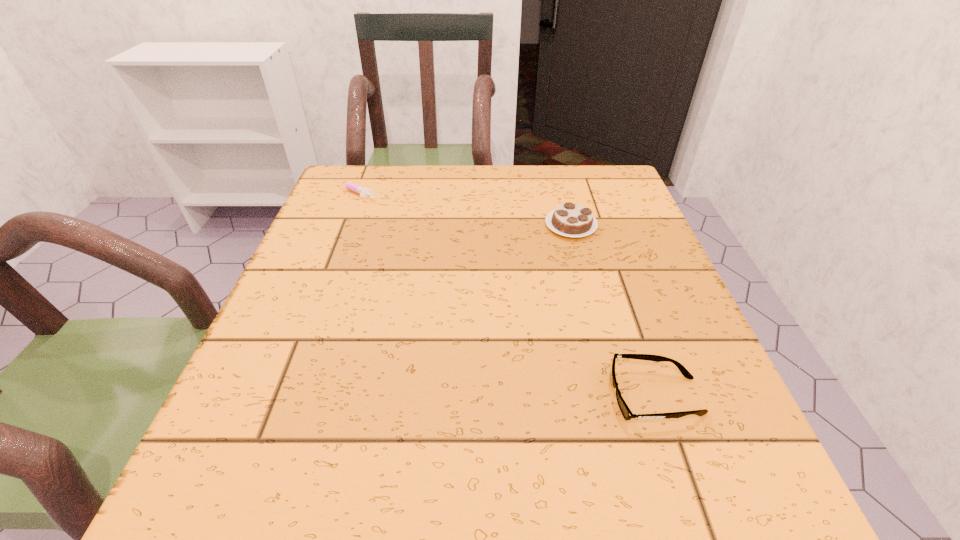
Locate an element on the screen. vacant area between the chocolate cake and the farthest object is located at coordinates (462, 209).

The width and height of the screenshot is (960, 540). In order to click on vacant point located between the second nearest object and the sunglasses in this screenshot , I will do `click(613, 311)`.

Locate an element on the screen. blank region between the sunglasses and the second farthest object is located at coordinates (613, 311).

Image resolution: width=960 pixels, height=540 pixels. What are the coordinates of `vacant area that lies between the farthest object and the second farthest object` in the screenshot? It's located at (462, 209).

Find the location of a particular element. The width and height of the screenshot is (960, 540). object identified as the closest to the leftmost object is located at coordinates 571,220.

You are a GUI agent. You are given a task and a screenshot of the screen. Output one action in this format:
    pyautogui.click(x=<x>, y=<y>)
    Task: Click on the object that ranks as the closest to the chocolate cake
    Image resolution: width=960 pixels, height=540 pixels.
    Given the screenshot: What is the action you would take?
    pyautogui.click(x=626, y=412)

Where is `vacant area in the image that satisfies the following two spatial constraints: 1. on the front side of the chocolate cake; 2. on the right side of the leftmost object`? vacant area in the image that satisfies the following two spatial constraints: 1. on the front side of the chocolate cake; 2. on the right side of the leftmost object is located at coordinates (340, 226).

You are a GUI agent. You are given a task and a screenshot of the screen. Output one action in this format:
    pyautogui.click(x=<x>, y=<y>)
    Task: Click on the free space that satisfies the following two spatial constraints: 1. on the front side of the farthest object; 2. on the left side of the chocolate cake
    
    Given the screenshot: What is the action you would take?
    pyautogui.click(x=340, y=226)

Identify the location of free space that satisfies the following two spatial constraints: 1. on the front side of the leftmost object; 2. on the left side of the second nearest object. (340, 226).

At what (x,y) coordinates should I click in order to perform the action: click on vacant space that satisfies the following two spatial constraints: 1. on the front side of the second farthest object; 2. on the right side of the farthest object. Please return your answer as a coordinate pair (x, y). Looking at the image, I should click on (340, 226).